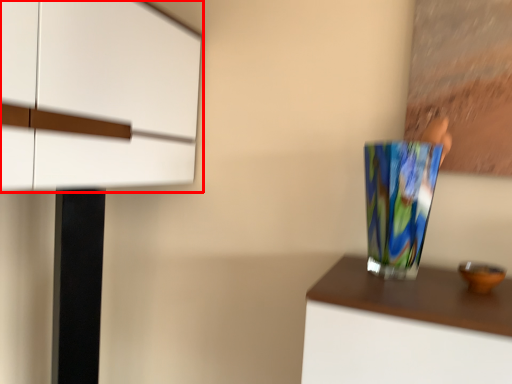
Question: Where is cabinetry (annotated by the red box) located in relation to vase in the image?

Choices:
 (A) right
 (B) left

Answer: (B)